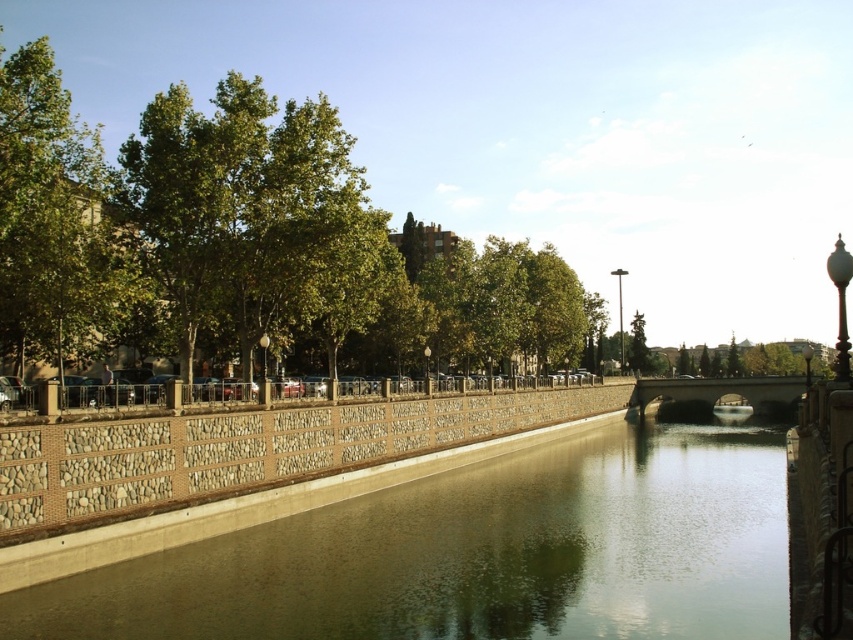
Is smooth concrete river at center positioned in front of concrete bridge at center?

Yes, it is in front of concrete bridge at center.

Who is taller, smooth concrete river at center or concrete bridge at center?

Standing taller between the two is concrete bridge at center.

This screenshot has height=640, width=853. What do you see at coordinates (479, 554) in the screenshot?
I see `smooth concrete river at center` at bounding box center [479, 554].

Where is `smooth concrete river at center`? This screenshot has height=640, width=853. smooth concrete river at center is located at coordinates (479, 554).

Does smooth concrete river at center have a larger size compared to green leafy tree at upper left?

No, smooth concrete river at center is not bigger than green leafy tree at upper left.

Can you confirm if smooth concrete river at center is positioned below green leafy tree at upper left?

Yes.

Measure the distance between smooth concrete river at center and camera.

45.05 meters

Image resolution: width=853 pixels, height=640 pixels. I want to click on smooth concrete river at center, so click(x=479, y=554).

Can you confirm if green leafy tree at upper left is positioned above concrete bridge at center?

Correct, green leafy tree at upper left is located above concrete bridge at center.

Can you confirm if green leafy tree at upper left is thinner than concrete bridge at center?

No, green leafy tree at upper left is not thinner than concrete bridge at center.

I want to click on green leafy tree at upper left, so click(254, 220).